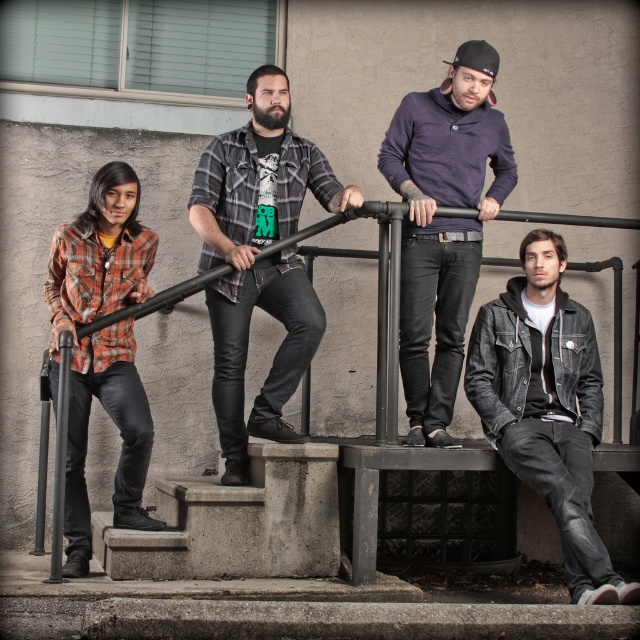
Question: Which of the following is the farthest from the observer?

Choices:
 (A) concrete stairs at lower center
 (B) plaid flannel shirt at left

Answer: (B)

Question: Which point is closer to the camera taking this photo?

Choices:
 (A) [x=269, y=564]
 (B) [x=250, y=108]

Answer: (A)

Question: Is purple sweater at center positioned in front of black matte rail at upper center?

Choices:
 (A) yes
 (B) no

Answer: (B)

Question: Can you confirm if plaid shirt at center is positioned to the left of plaid flannel shirt at left?

Choices:
 (A) no
 (B) yes

Answer: (A)

Question: Which point is farther to the camera?

Choices:
 (A) (620, 600)
 (B) (307, 332)
 (C) (486, 216)

Answer: (C)

Question: Is purple sweater at center to the left of concrete stairs at lower center from the viewer's perspective?

Choices:
 (A) no
 (B) yes

Answer: (A)